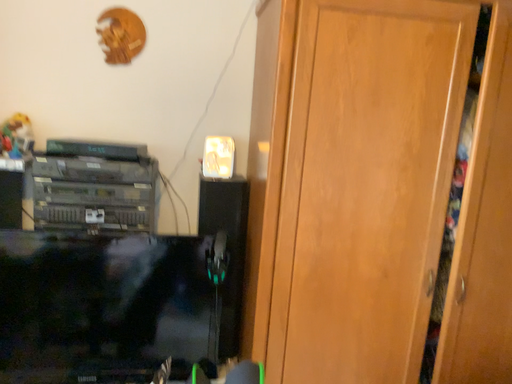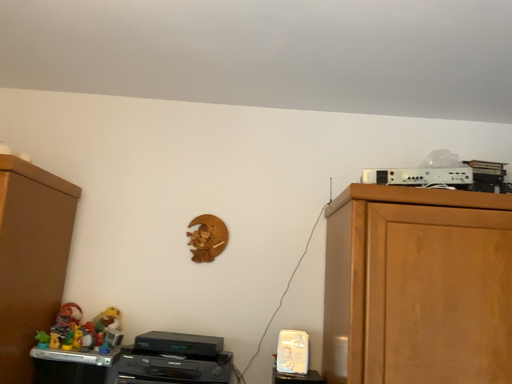
Question: Which way did the camera rotate in the video?

Choices:
 (A) rotated downward
 (B) rotated upward

Answer: (B)